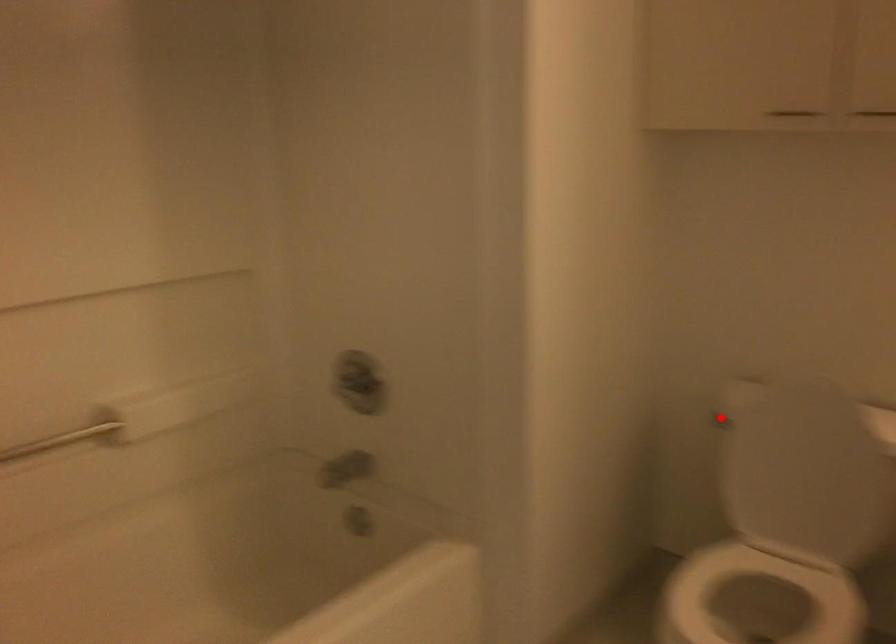
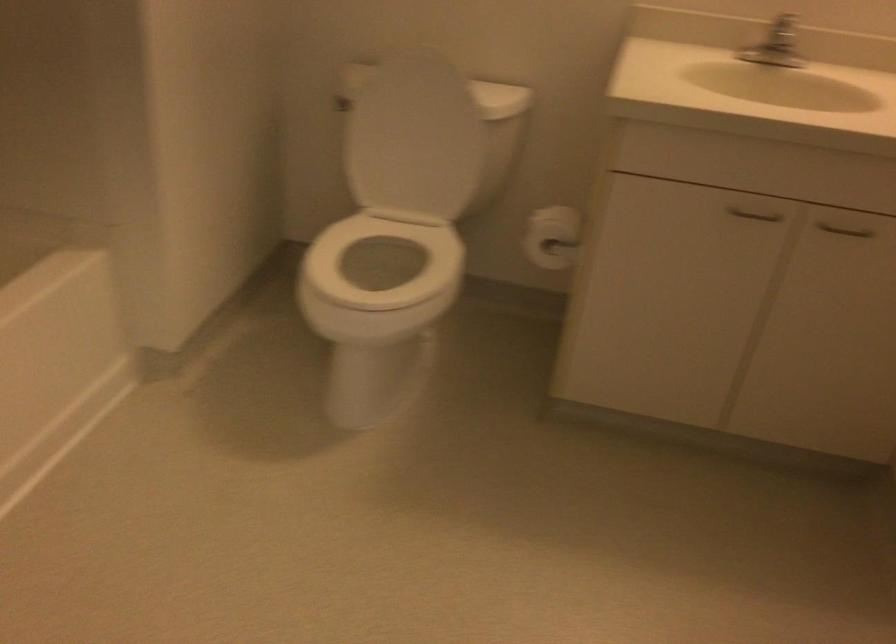
The point at the highlighted location is marked in the first image. Where is the corresponding point in the second image?

(340, 104)